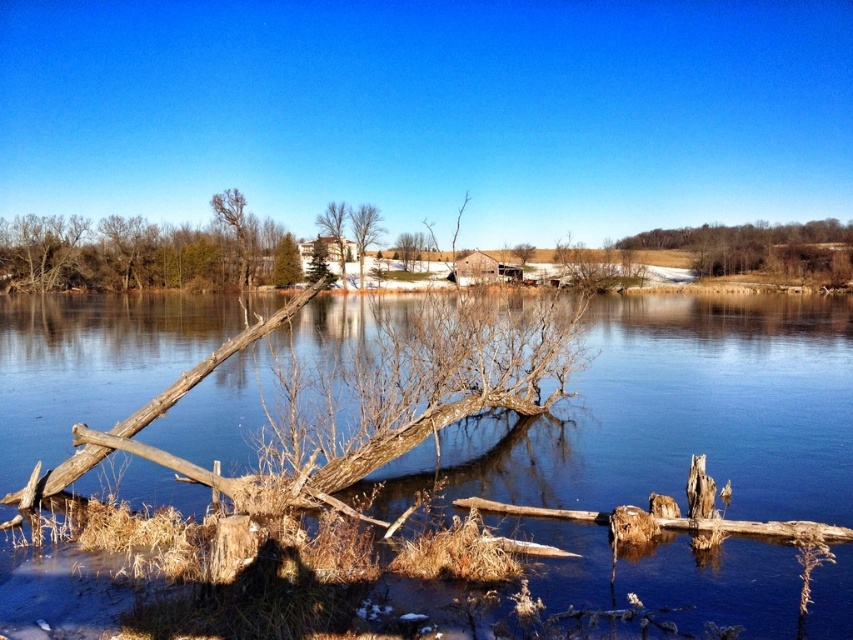
Question: Does brown rough tree at upper right have a lesser width compared to bare wood tree at upper left?

Choices:
 (A) no
 (B) yes

Answer: (A)

Question: Which point appears closest to the camera in this image?

Choices:
 (A) (772, 260)
 (B) (306, 275)

Answer: (A)

Question: Is clear blue water at center bigger than brown rough tree at upper right?

Choices:
 (A) yes
 (B) no

Answer: (A)

Question: Considering the real-world distances, which object is farthest from the brown rough tree trunk at center?

Choices:
 (A) bare wood tree at upper left
 (B) clear blue water at center
 (C) green matte evergreen tree at center
 (D) brown rough tree at upper right

Answer: (B)

Question: Based on their relative distances, which object is nearer to the brown rough tree at upper right?

Choices:
 (A) smooth white house at center
 (B) green matte tree at center
 (C) bare wood tree at upper left
 (D) green matte evergreen tree at center

Answer: (A)

Question: Is the position of clear blue water at center less distant than that of smooth white house at center?

Choices:
 (A) yes
 (B) no

Answer: (A)